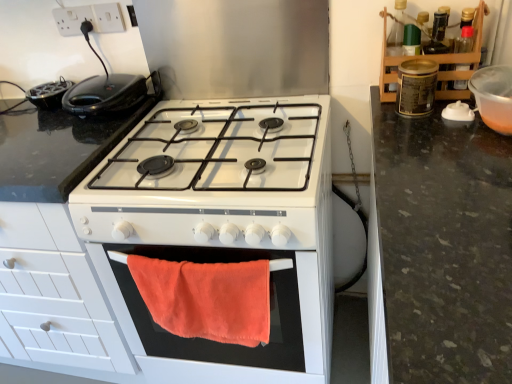
The height and width of the screenshot is (384, 512). Find the location of `free space in front of black plastic sandwich maker at upper left`. free space in front of black plastic sandwich maker at upper left is located at coordinates (76, 141).